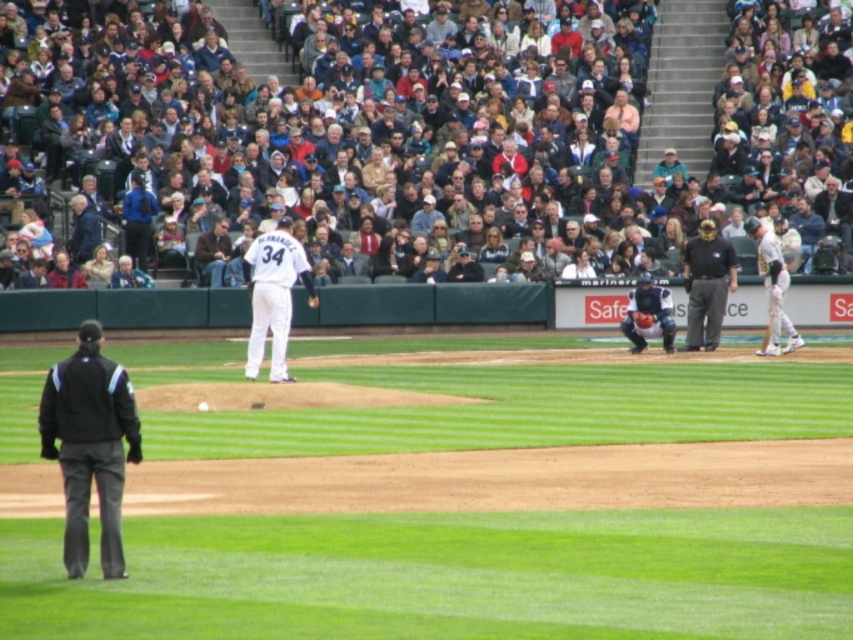
You are a photographer positioned at the edge of the field. You want to take a photo that includes both the black shirt at center and the dark blue fabric catcher at center. Which object will appear larger in your photo?

The black shirt at center will appear larger in the photo because it is closer to the photographer than the dark blue fabric catcher at center.

You are a photographer standing at the edge of the field. You want to take a photo of the black shirt at center and the dark blue fabric catcher at center. If your camera has a maximum focus range of 20 inches, will both subjects be in focus?

The distance between the black shirt at center and the dark blue fabric catcher at center is 21.06 inches, which exceeds the camera focus range of 20 inches. Therefore, both subjects cannot be in focus simultaneously.

You are a photographer standing at the edge of the field. You want to take a photo of the dark blue fabric catcher at center. Where should you position yourself to capture the best angle?

Position yourself directly in front of the dark blue fabric catcher at center to ensure it is centered in your frame, as it is located at point (648,316).